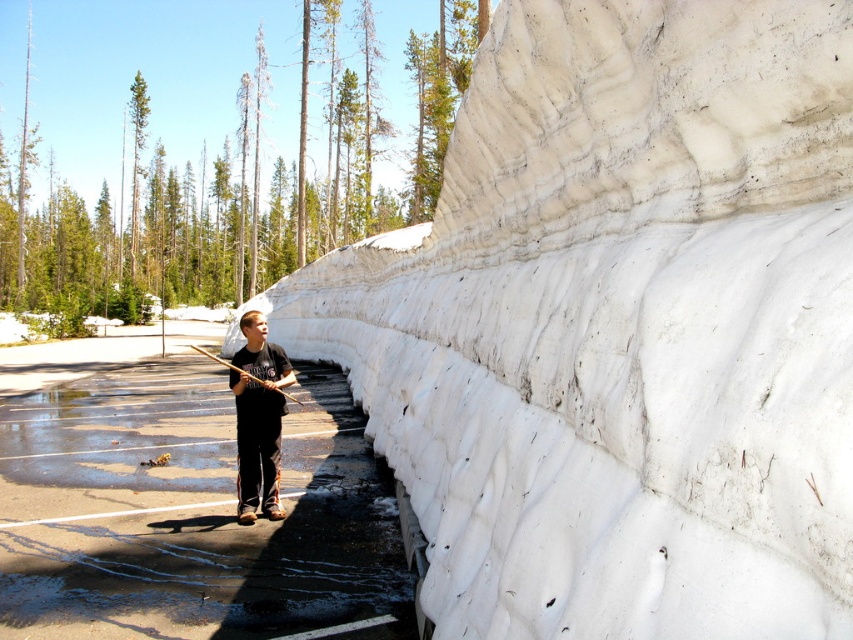
Based on the photo, you are standing in the parking lot and see two points marked in the image. Which point is nearer to you, point (434, 595) or point (268, 483)?

Point (434, 595) is closer to the camera than point (268, 483).

You are standing on the asphalt parking lot and see a point marked at coordinates (619, 326). What is located at that point?

The point at coordinates (619, 326) indicates white fluffy snow at center.

You are standing in the parking lot and see the white fluffy snow at center and the wooden fishing pole at center. Which object is nearer to you?

The white fluffy snow at center is closer to the viewer than the wooden fishing pole at center.